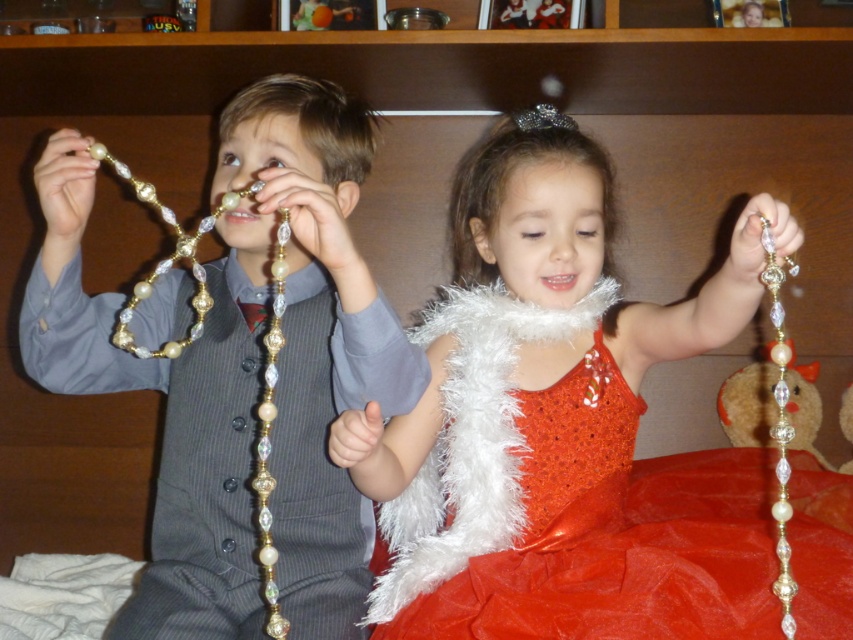
Question: Is shiny gold necklace at center smaller than matte gold necklace at left?

Choices:
 (A) yes
 (B) no

Answer: (B)

Question: Does shiny gold necklace at center appear on the left side of matte gold necklace at left?

Choices:
 (A) yes
 (B) no

Answer: (B)

Question: Among these points, which one is nearest to the camera?

Choices:
 (A) (540, 125)
 (B) (242, 324)
 (C) (563, 417)

Answer: (B)

Question: Is the position of shiny gold necklace at center more distant than that of matte gold necklace at left?

Choices:
 (A) yes
 (B) no

Answer: (B)

Question: Which point appears farthest from the camera in this image?

Choices:
 (A) (572, 128)
 (B) (462, 504)
 (C) (235, 456)

Answer: (A)

Question: Which object is positioned closest to the matte gold necklace at left?

Choices:
 (A) shiny gold necklace at center
 (B) sparkly silver tiara at upper center

Answer: (A)